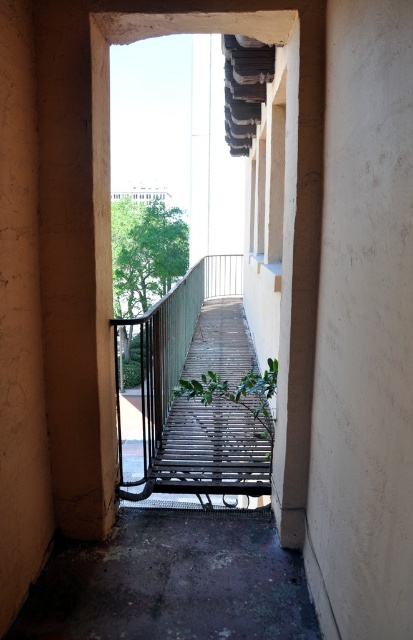
You are standing at the entrance of the corridor and want to walk straight ahead towards the balcony. There is a point marked at coordinates (363, 330) on the wall. What object or feature is located at that point?

The point at coordinates (363, 330) marks the white smooth wall at center.

You are standing at the entrance of the corridor and want to reach the balcony. Which wall, the white smooth wall at center or the smooth beige wall at left, is closer to you as you face the corridor?

The white smooth wall at center is closer to the viewer than the smooth beige wall at left, so the white smooth wall at center is closer to you as you face the corridor.